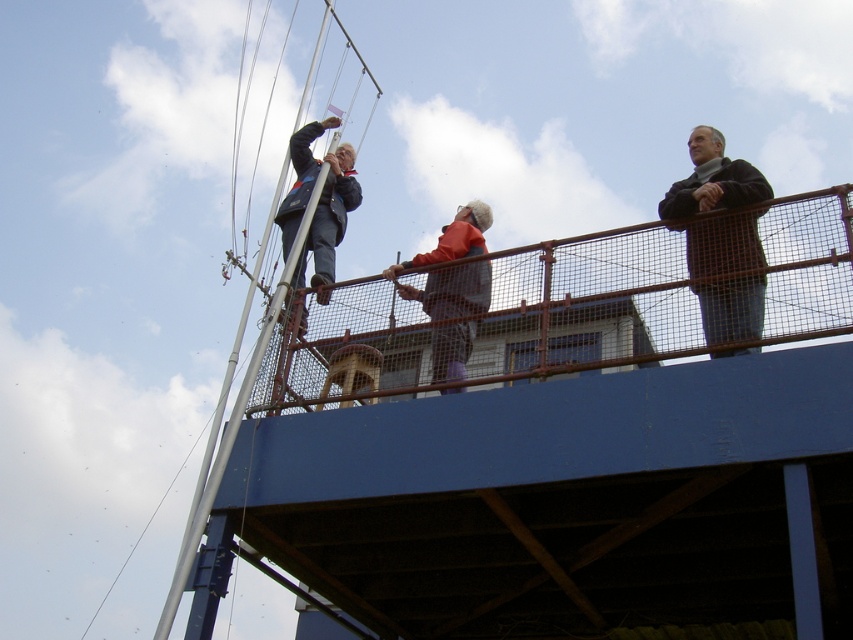
Which is above, dark brown leather jacket at upper right or metallic silver mast at upper left?

dark brown leather jacket at upper right

Which of these two, dark brown leather jacket at upper right or metallic silver mast at upper left, stands shorter?

With less height is dark brown leather jacket at upper right.

What are the coordinates of `dark brown leather jacket at upper right` in the screenshot? It's located at (712, 179).

Is dark brown leather jacket at upper right taller than orange fabric jacket at center?

Indeed, dark brown leather jacket at upper right has a greater height compared to orange fabric jacket at center.

Between point (723, 168) and point (473, 330), which one is positioned behind?

The point (473, 330) is more distant.

Which is in front, point (703, 230) or point (479, 291)?

Point (703, 230) is more forward.

Where is `dark brown leather jacket at upper right`? Image resolution: width=853 pixels, height=640 pixels. dark brown leather jacket at upper right is located at coordinates (712, 179).

What do you see at coordinates (451, 291) in the screenshot? This screenshot has width=853, height=640. I see `orange fabric jacket at center` at bounding box center [451, 291].

Is point (436, 276) behind point (267, 337)?

Yes, it is behind point (267, 337).

Is point (467, 244) less distant than point (279, 177)?

Yes, point (467, 244) is in front of point (279, 177).

The height and width of the screenshot is (640, 853). I want to click on orange fabric jacket at center, so click(451, 291).